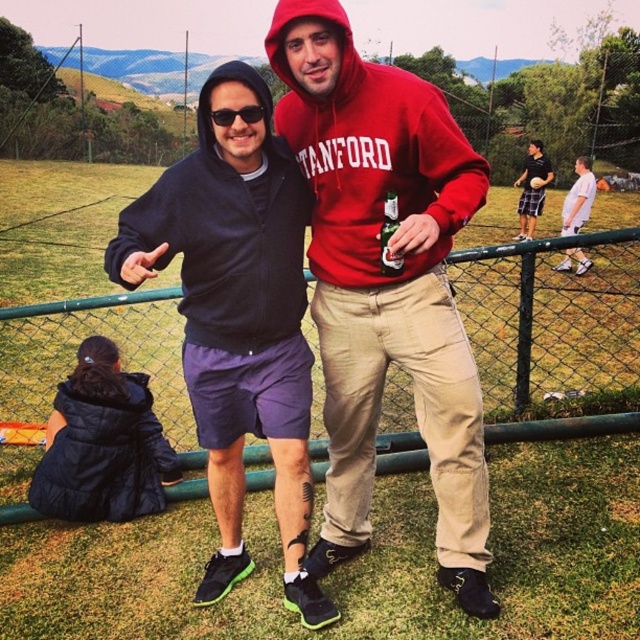
Question: Which point appears farthest from the camera in this image?

Choices:
 (A) [241, 109]
 (B) [333, 52]
 (C) [582, 179]
 (D) [193, 326]

Answer: (C)

Question: Is red matte hoodie at center below white matte shirt at right?

Choices:
 (A) no
 (B) yes

Answer: (B)

Question: Among these points, which one is farthest from the camera?

Choices:
 (A) (301, 504)
 (B) (13, 321)

Answer: (B)

Question: Among these points, which one is nearest to the camera?

Choices:
 (A) (260, 189)
 (B) (563, 282)
 (C) (346, 433)
 (D) (582, 269)

Answer: (A)

Question: Does red matte hoodie at center come behind matte black hoodie at center?

Choices:
 (A) no
 (B) yes

Answer: (B)

Question: Where is matte black hoodie at center located in relation to green chain-link fence at center in the image?

Choices:
 (A) below
 (B) above

Answer: (A)